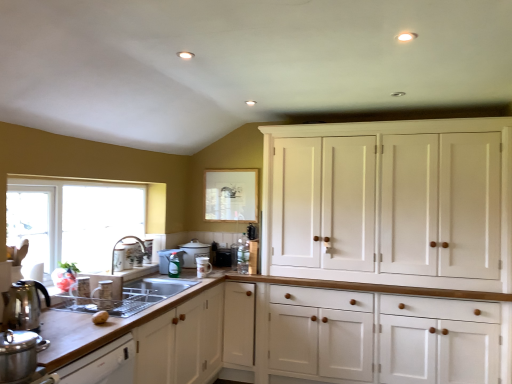
Question: Based on their positions, is white ceramic mug at center, which is the third appliance from front to back, located to the left or right of satin silver sink at lower left?

Choices:
 (A) left
 (B) right

Answer: (B)

Question: Is point (206, 263) positioned closer to the camera than point (126, 309)?

Choices:
 (A) closer
 (B) farther

Answer: (B)

Question: Which is nearer to the white ceramic mug at center, which is the third appliance from front to back?

Choices:
 (A) shiny metallic kettle at left
 (B) transparent glass window screen at upper center
 (C) stainless steel pot at lower left, which is the 6th appliance in back-to-front order
 (D) translucent plastic spray bottle at center, marked as the 3th appliance in a back-to-front arrangement
 (E) clear glass window at left

Answer: (D)

Question: Estimate the real-world distances between objects in this image. Which object is farther from the wooden countertop at lower left?

Choices:
 (A) transparent glass window screen at upper center
 (B) stainless steel pot at lower left, which is the first appliance from front to back
 (C) white wood cabinet at upper right
 (D) matte silver faucet at sink left
 (E) brown matte potato at lower left

Answer: (C)